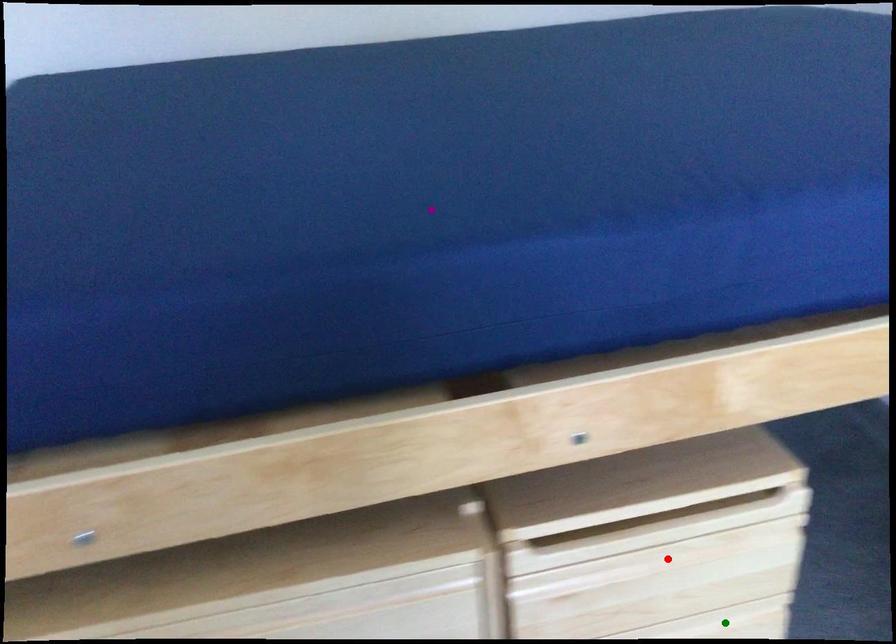
Order these from nearest to farthest:
A) green point
B) red point
C) purple point

purple point
red point
green point